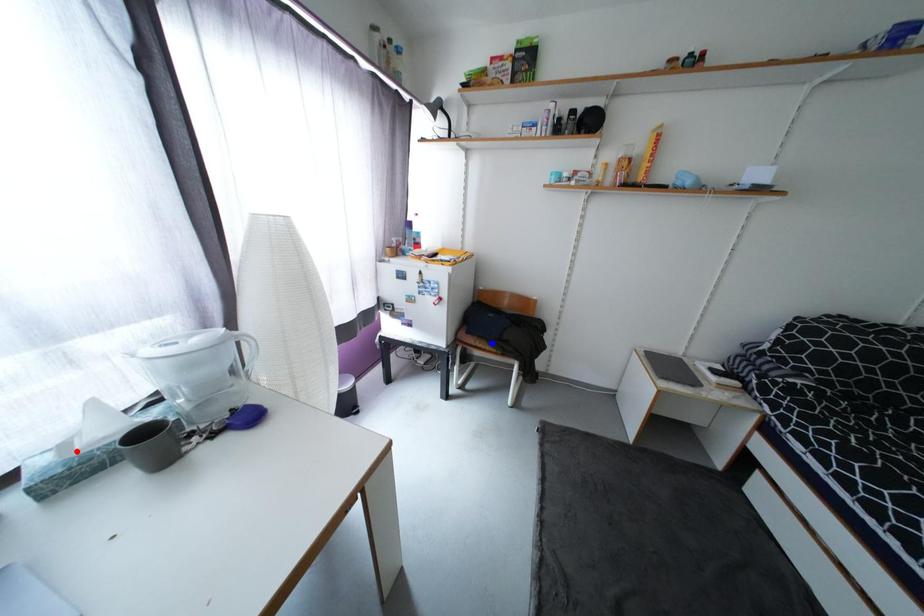
Question: In the image, two points are highlighted. Which point is nearer to the camera? Reply with the corresponding letter.

Choices:
 (A) blue point
 (B) red point

Answer: (B)